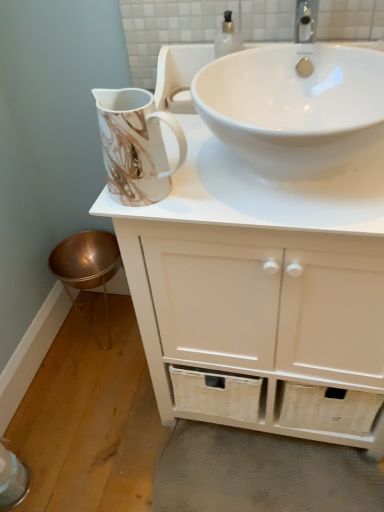
Question: From their relative heights in the image, would you say white matte cabinet at upper center is taller or shorter than marble-patterned ceramic jug at upper left?

Choices:
 (A) tall
 (B) short

Answer: (A)

Question: Does point (289, 354) appear closer or farther from the camera than point (125, 189)?

Choices:
 (A) closer
 (B) farther

Answer: (B)

Question: Which object is positioned closest to the white glossy sink at upper center?

Choices:
 (A) white matte cabinet at upper center
 (B) marble-patterned ceramic jug at upper left
 (C) gray woven bath mat at lower center

Answer: (B)

Question: Estimate the real-world distances between objects in this image. Which object is closer to the marble-patterned ceramic jug at upper left?

Choices:
 (A) white matte cabinet at upper center
 (B) white glossy sink at upper center
 (C) gray woven bath mat at lower center

Answer: (B)